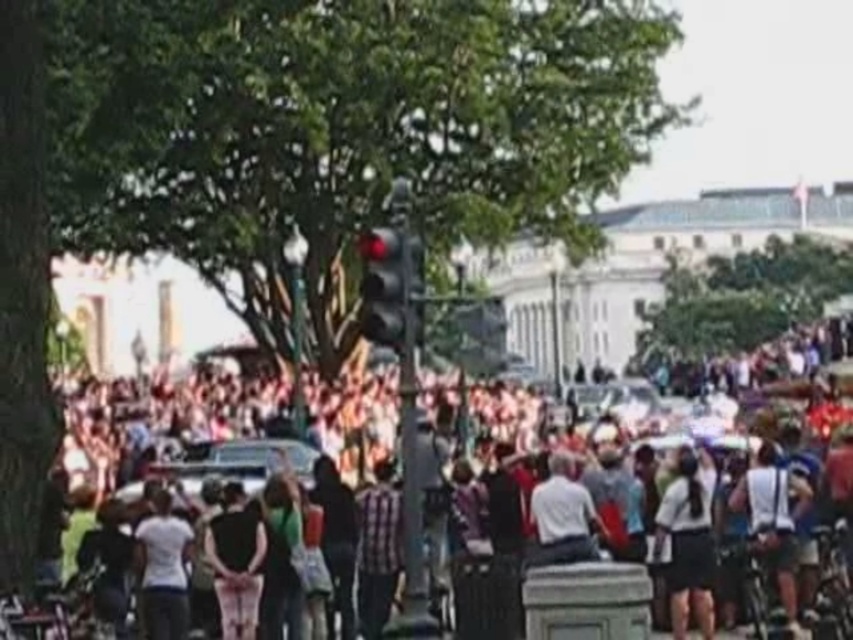
You are a pedestrian trying to cross the street at the intersection where the traffic light is. You see the matte black crowd at center and the black glass traffic light at center. Which direction should you look to see the crowd relative to the traffic light?

The matte black crowd at center is on the right side of the black glass traffic light at center, so you should look to your right to see the crowd relative to the traffic light.

You are a city planner analyzing this urban scene. The traffic light is at the center of the image. Where is the matte black crowd at center located in relation to the traffic light?

The matte black crowd at center is located at point 0.680 on the horizontal axis and 0.211 on the vertical axis relative to the traffic light at the center.

You are standing at the point marked by the coordinates (178, 435) in the image. What do you see immediately around you?

The point at coordinates (178, 435) marks the matte black crowd at center, so you are surrounded by the crowd in the middle of the image.